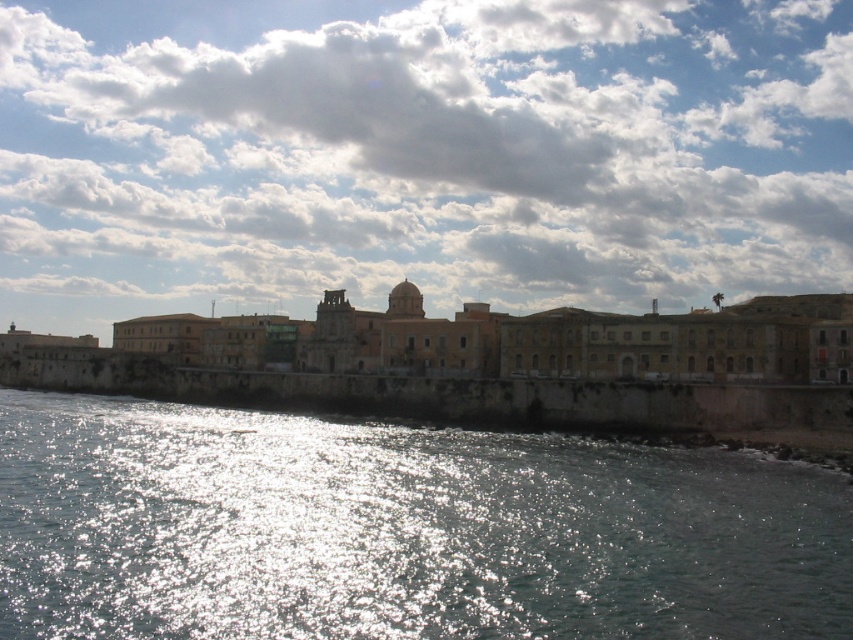
Which is in front, point (624, 252) or point (186, 516)?

Positioned in front is point (186, 516).

Is cloudy sky at upper center thinner than glistening water at lower left?

No, cloudy sky at upper center is not thinner than glistening water at lower left.

Is point (386, 259) positioned before point (44, 524)?

No, it is behind (44, 524).

I want to click on cloudy sky at upper center, so click(419, 154).